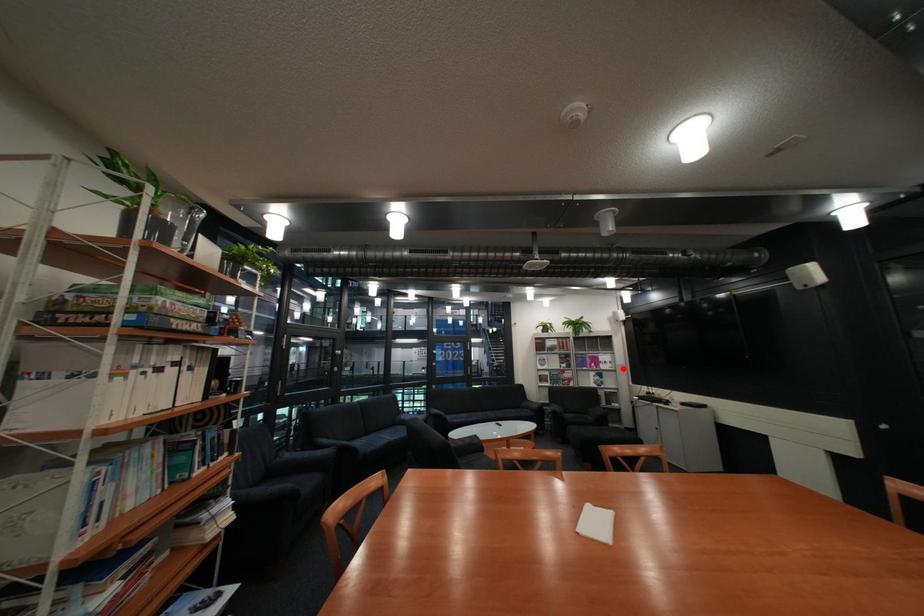
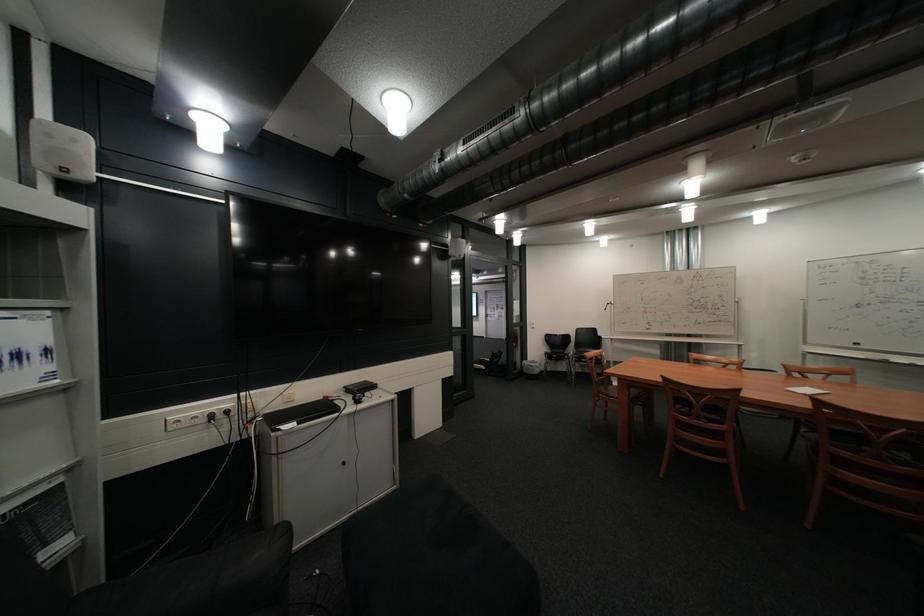
Where in the second image is the point corresponding to the highlighted location from the first image?

(46, 386)